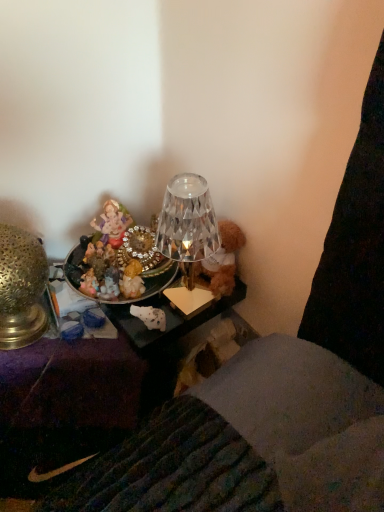
Question: Would you say gold textured lamp at left is inside or outside metallic/mesh tray at left?

Choices:
 (A) inside
 (B) outside

Answer: (B)

Question: Considering the positions of gold textured lamp at left and metallic/mesh tray at left in the image, is gold textured lamp at left bigger or smaller than metallic/mesh tray at left?

Choices:
 (A) small
 (B) big

Answer: (A)

Question: Estimate the real-world distances between objects in this image. Which object is closer to the porcelain figurine at upper center?

Choices:
 (A) gold textured lamp at left
 (B) metallic/mesh tray at left

Answer: (A)

Question: Estimate the real-world distances between objects in this image. Which object is closer to the porcelain figurine at upper center?

Choices:
 (A) gold textured lamp at left
 (B) metallic/mesh tray at left

Answer: (A)